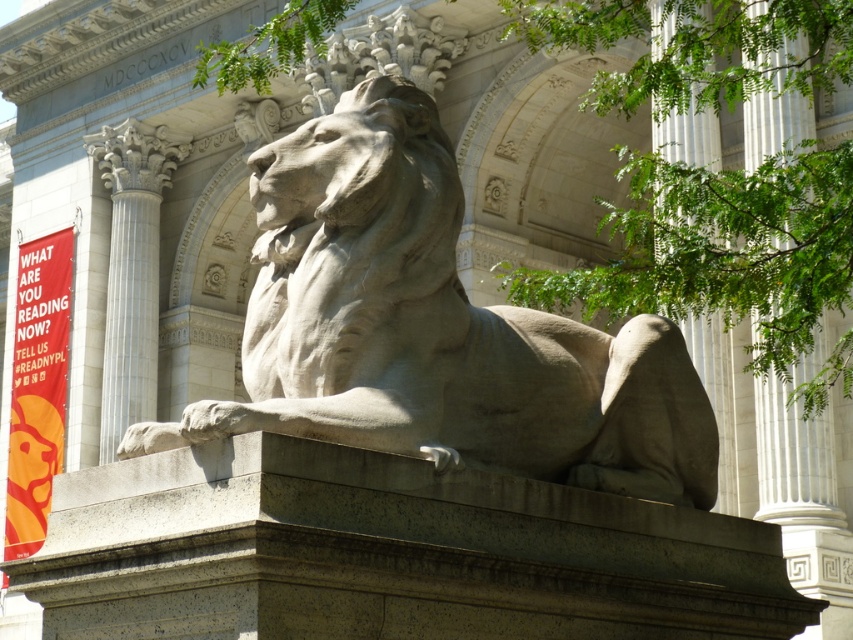
Based on the photo, can you confirm if gray stone lion at center is smaller than gray stone paw at lower left?

Yes, gray stone lion at center is smaller than gray stone paw at lower left.

Is point (503, 410) positioned in front of point (178, 445)?

No, (503, 410) is behind (178, 445).

The height and width of the screenshot is (640, 853). Identify the location of gray stone lion at center. (438, 326).

How distant is white marble column at center from gray stone paw at lower left?

white marble column at center and gray stone paw at lower left are 7.90 meters apart.

Which is in front, point (103, 420) or point (138, 429)?

Point (138, 429)

This screenshot has height=640, width=853. Identify the location of white marble column at center. (131, 268).

Which is in front, point (389, 96) or point (152, 396)?

Point (389, 96) is in front.

Find the location of a particular element. The height and width of the screenshot is (640, 853). gray stone lion at center is located at coordinates (438, 326).